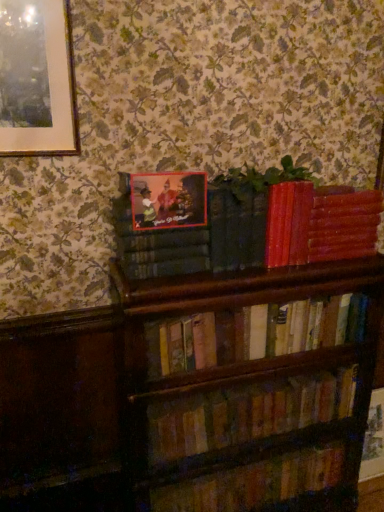
Question: In terms of width, does green matte plant at upper center look wider or thinner when compared to wooden bookshelf at lower center, the 3th book positioned from the top?

Choices:
 (A) wide
 (B) thin

Answer: (A)

Question: Would you say green matte plant at upper center is to the left or to the right of wooden bookshelf at lower center, arranged as the second book when ordered from the bottom, in the picture?

Choices:
 (A) right
 (B) left

Answer: (A)

Question: Which is nearer to the green matte plant at upper center?

Choices:
 (A) matte plastic picture frame at upper center
 (B) wooden book at lower center, which ranks as the first book in bottom-to-top order
 (C) wooden bookshelf at lower center, the 3th book positioned from the top
 (D) wooden bookshelf at center, the second book viewed from the top
 (E) smooth red book at upper right, acting as the 4th book starting from the bottom

Answer: (E)

Question: Based on their relative distances, which object is nearer to the smooth red book at upper right, acting as the 4th book starting from the bottom?

Choices:
 (A) wooden book at lower center, which ranks as the first book in bottom-to-top order
 (B) green matte plant at upper center
 (C) matte plastic picture frame at upper center
 (D) wooden bookshelf at center, the 3th book positioned from the bottom
 (E) wooden bookshelf at lower center, arranged as the second book when ordered from the bottom

Answer: (B)